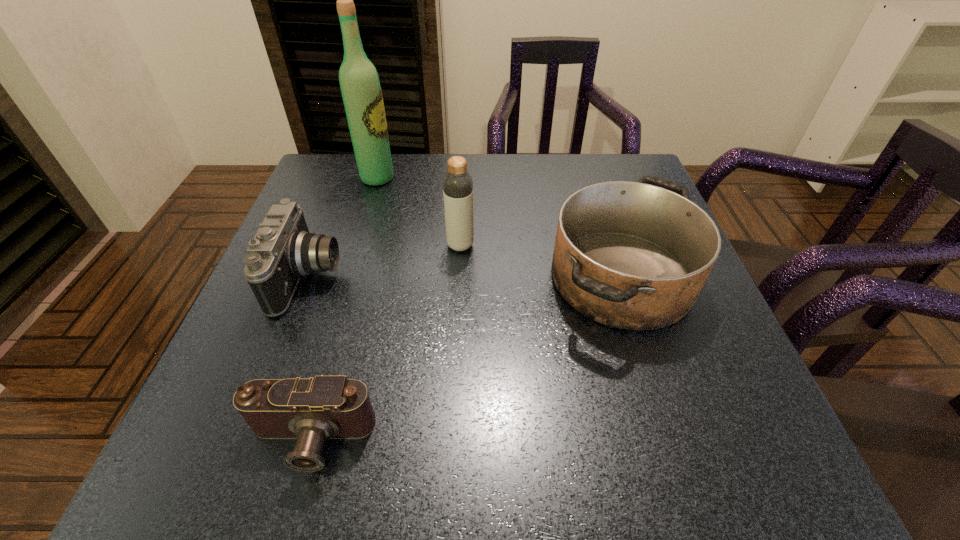
I want to click on the farthest object, so click(x=361, y=90).

Where is `wine bottle`? wine bottle is located at coordinates (361, 90).

Locate an element on the screen. This screenshot has width=960, height=540. the second object from right to left is located at coordinates (457, 183).

At what (x,y) coordinates should I click in order to perform the action: click on bottle. Please return your answer as a coordinate pair (x, y). The height and width of the screenshot is (540, 960). Looking at the image, I should click on (457, 183).

Locate an element on the screen. This screenshot has width=960, height=540. the farther camera is located at coordinates (282, 251).

Identify the location of saucepan. 631,255.

The height and width of the screenshot is (540, 960). I want to click on the nearest object, so click(313, 410).

Locate an element on the screen. The image size is (960, 540). the nearer camera is located at coordinates (313, 410).

Where is `vacant area situated on the front-facing side of the tallest object`? The width and height of the screenshot is (960, 540). vacant area situated on the front-facing side of the tallest object is located at coordinates (508, 178).

I want to click on free spot located 0.080m on the back of the fourth shortest object, so click(x=462, y=215).